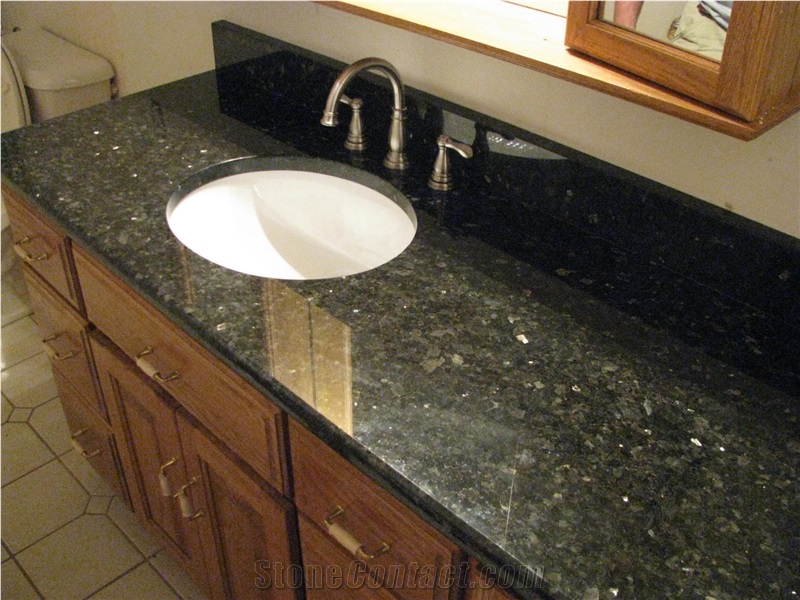
Find the location of `white wall`. white wall is located at coordinates (770, 193).